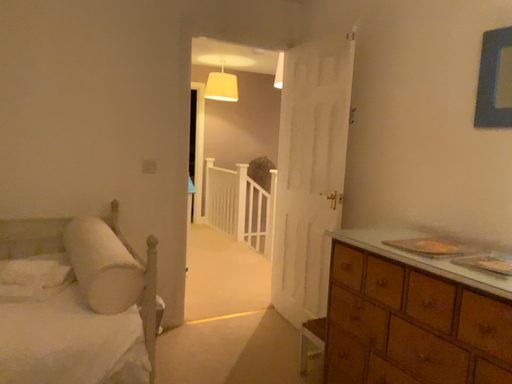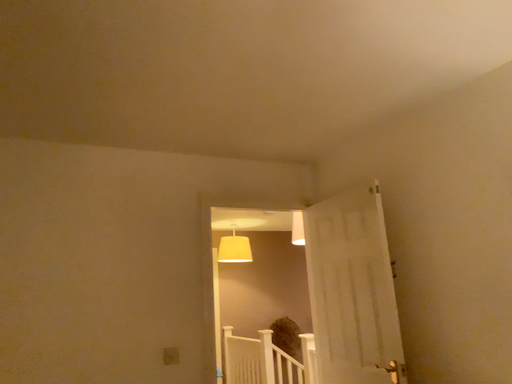
Question: How did the camera likely rotate when shooting the video?

Choices:
 (A) rotated downward
 (B) rotated upward

Answer: (B)